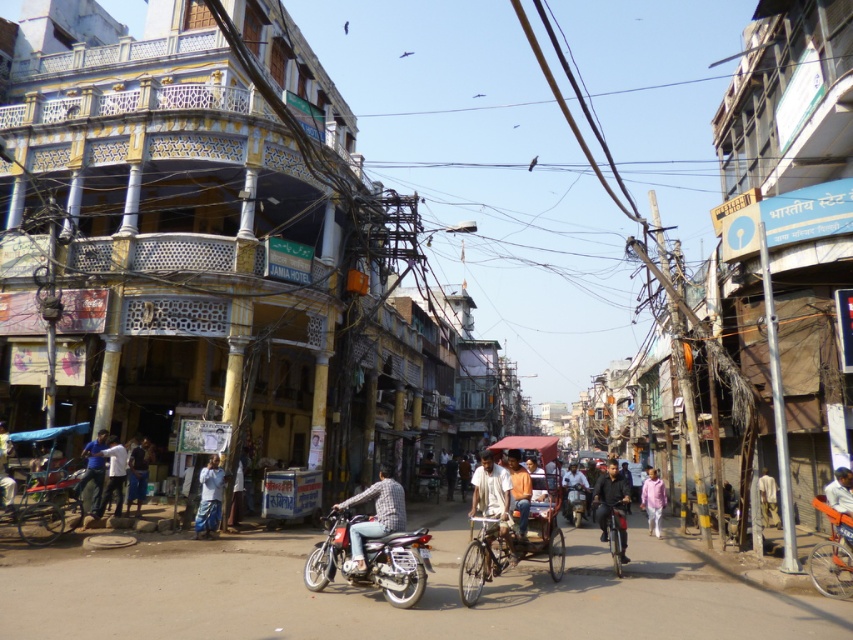
Question: Among these objects, which one is farthest from the camera?

Choices:
 (A) shiny metallic bicycle at center
 (B) blue cotton shirt at lower left
 (C) orange cotton shirt at center
 (D) light brown wooden bicycle at center

Answer: (B)

Question: Observing the image, what is the correct spatial positioning of light brown wooden bicycle at center in reference to shiny metallic bicycle at center?

Choices:
 (A) below
 (B) above

Answer: (B)

Question: From the image, what is the correct spatial relationship of pink cotton shirt at center in relation to shiny chrome motorcycle at center?

Choices:
 (A) above
 (B) below

Answer: (A)

Question: Which point is closer to the camera?

Choices:
 (A) (508, 465)
 (B) (105, 492)
 (C) (843, 502)

Answer: (C)

Question: Which of the following is the farthest from the observer?

Choices:
 (A) (657, 497)
 (B) (370, 582)

Answer: (A)

Question: Does orange fabric cart at center have a smaller size compared to shiny chrome motorcycle at center?

Choices:
 (A) yes
 (B) no

Answer: (B)